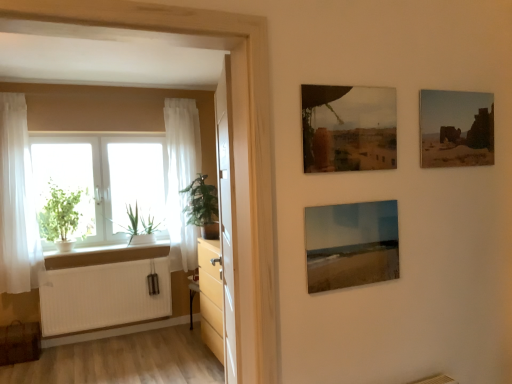
What is the approximate height of white sheer curtain at left, acting as the 2th curtain starting from the right?

It is 5.82 feet.

At what (x,y) coordinates should I click in order to perform the action: click on green leafy plant at left. Please return your answer as a coordinate pair (x, y). The image size is (512, 384). Looking at the image, I should click on (138, 226).

The image size is (512, 384). What do you see at coordinates (104, 180) in the screenshot?
I see `white glass window at left` at bounding box center [104, 180].

The image size is (512, 384). I want to click on white sheer curtain at left, the 1th curtain viewed from the right, so click(181, 178).

Describe the element at coordinates (102, 295) in the screenshot. I see `white ribbed radiator at lower left` at that location.

Locate an element on the screen. The width and height of the screenshot is (512, 384). white sheer curtain at left, acting as the 2th curtain starting from the right is located at coordinates 17,201.

Can you tell me how much white sheer curtain at left, positioned as the second curtain in left-to-right order, and white sheer curtain at left, which ranks as the 2th curtain in back-to-front order, differ in facing direction?

0.00269 degrees separate the facing orientations of white sheer curtain at left, positioned as the second curtain in left-to-right order, and white sheer curtain at left, which ranks as the 2th curtain in back-to-front order.

Is white sheer curtain at left, positioned as the second curtain in left-to-right order, touching white sheer curtain at left, the first curtain positioned from the front?

No, white sheer curtain at left, positioned as the second curtain in left-to-right order, is not next to white sheer curtain at left, the first curtain positioned from the front.

Is white sheer curtain at left, the second curtain when ordered from front to back, at the right side of white sheer curtain at left, marked as the first curtain in a left-to-right arrangement?

Yes, white sheer curtain at left, the second curtain when ordered from front to back, is to the right of white sheer curtain at left, marked as the first curtain in a left-to-right arrangement.

Between white sheer curtain at left, the second curtain when ordered from front to back, and white sheer curtain at left, marked as the first curtain in a left-to-right arrangement, which one is positioned behind?

white sheer curtain at left, the second curtain when ordered from front to back.

Is white glass window at left at the left side of green leafy plant at left?

Indeed, white glass window at left is positioned on the left side of green leafy plant at left.

Find the location of a particular element. plant behind the white glass window at left is located at coordinates (138, 226).

From a real-world perspective, which object rests below the other?

green leafy plant at left.

How many degrees apart are the facing directions of white glass window at left and green leafy plant at left?

white glass window at left and green leafy plant at left are facing 0.0072 degrees away from each other.

Relative to white sheer curtain at left, the second curtain when ordered from front to back, is white wood window sill at lower left in front or behind?

white wood window sill at lower left is positioned closer to the viewer than white sheer curtain at left, the second curtain when ordered from front to back.

Between white wood window sill at lower left and white sheer curtain at left, placed as the first curtain when sorted from back to front, which one appears on the right side from the viewer's perspective?

white sheer curtain at left, placed as the first curtain when sorted from back to front, is more to the right.

From a real-world perspective, between white wood window sill at lower left and white sheer curtain at left, the 1th curtain viewed from the right, who is vertically lower?

From a 3D spatial view, white wood window sill at lower left is below.

Is white ribbed radiator at lower left at the left side of green leafy plant at left, marked as the first houseplant in a right-to-left arrangement?

Yes, white ribbed radiator at lower left is to the left of green leafy plant at left, marked as the first houseplant in a right-to-left arrangement.

Is white ribbed radiator at lower left next to green leafy plant at left, marked as the first houseplant in a right-to-left arrangement?

white ribbed radiator at lower left and green leafy plant at left, marked as the first houseplant in a right-to-left arrangement, are not in contact.

Is white ribbed radiator at lower left in front of or behind green leafy plant at left, marked as the first houseplant in a right-to-left arrangement, in the image?

white ribbed radiator at lower left is behind green leafy plant at left, marked as the first houseplant in a right-to-left arrangement.

Considering the points (57, 293) and (210, 226), which point is in front, point (57, 293) or point (210, 226)?

Point (210, 226)

Is white wood window sill at lower left in front of or behind white glass window at left in the image?

Clearly, white wood window sill at lower left is in front of white glass window at left.

Is white wood window sill at lower left positioned far away from white glass window at left?

No, white wood window sill at lower left is not far away from white glass window at left.

Is white wood window sill at lower left positioned beyond the bounds of white glass window at left?

Yes, white wood window sill at lower left is not within white glass window at left.

Which is correct: white sheer curtain at left, positioned as the second curtain in left-to-right order, is inside green matte plant at left, arranged as the 2th houseplant when viewed from the right, or outside of it?

white sheer curtain at left, positioned as the second curtain in left-to-right order, is not inside green matte plant at left, arranged as the 2th houseplant when viewed from the right, it's outside.

From a real-world perspective, is white sheer curtain at left, placed as the first curtain when sorted from back to front, physically below green matte plant at left, arranged as the first houseplant when viewed from the left?

No, from a real-world perspective, white sheer curtain at left, placed as the first curtain when sorted from back to front, is not under green matte plant at left, arranged as the first houseplant when viewed from the left.

From the picture: Can you confirm if white sheer curtain at left, positioned as the second curtain in left-to-right order, is taller than green matte plant at left, arranged as the first houseplant when viewed from the left?

Correct, white sheer curtain at left, positioned as the second curtain in left-to-right order, is much taller as green matte plant at left, arranged as the first houseplant when viewed from the left.

From the image's perspective, which one is positioned lower, white sheer curtain at left, the second curtain when ordered from front to back, or green matte plant at left, arranged as the first houseplant when viewed from the left?

From the image's view, green matte plant at left, arranged as the first houseplant when viewed from the left, is below.

Is white sheer curtain at left, the 1th curtain viewed from the right, directly adjacent to green leafy plant at left, placed as the second houseplant when sorted from left to right?

No, white sheer curtain at left, the 1th curtain viewed from the right, is not next to green leafy plant at left, placed as the second houseplant when sorted from left to right.

At what (x,y) coordinates should I click in order to perform the action: click on the 1st curtain above the green leafy plant at left, placed as the second houseplant when sorted from left to right (from a real-world perspective). Please return your answer as a coordinate pair (x, y). The width and height of the screenshot is (512, 384). Looking at the image, I should click on (181, 178).

Does white sheer curtain at left, the second curtain when ordered from front to back, have a greater height compared to green leafy plant at left, placed as the second houseplant when sorted from left to right?

Correct, white sheer curtain at left, the second curtain when ordered from front to back, is much taller as green leafy plant at left, placed as the second houseplant when sorted from left to right.

Which object is thinner, white sheer curtain at left, the second curtain when ordered from front to back, or green leafy plant at left, placed as the second houseplant when sorted from left to right?

white sheer curtain at left, the second curtain when ordered from front to back, is thinner.

I want to click on curtain on the left of white sheer curtain at left, the second curtain when ordered from front to back, so click(x=17, y=201).

The image size is (512, 384). Find the location of `window that is above the green leafy plant at left (from a real-world perspective)`. window that is above the green leafy plant at left (from a real-world perspective) is located at coordinates (104, 180).

Considering their positions, is white wood window sill at lower left positioned closer to white sheer curtain at left, the second curtain when ordered from front to back, than white ribbed radiator at lower left?

The object closer to white sheer curtain at left, the second curtain when ordered from front to back, is white wood window sill at lower left.

Which object lies nearer to the anchor point white sheer curtain at left, marked as the first curtain in a left-to-right arrangement, white ribbed radiator at lower left or green leafy plant at left?

Based on the image, white ribbed radiator at lower left appears to be nearer to white sheer curtain at left, marked as the first curtain in a left-to-right arrangement.

Considering their positions, is white sheer curtain at left, which ranks as the 2th curtain in back-to-front order, positioned further to white sheer curtain at left, placed as the first curtain when sorted from back to front, than white glass window at left?

white sheer curtain at left, which ranks as the 2th curtain in back-to-front order, is positioned further to the anchor white sheer curtain at left, placed as the first curtain when sorted from back to front.

Consider the image. When comparing their distances from white ribbed radiator at lower left, does green matte plant at left, arranged as the 2th houseplant when viewed from the right, or white wood window sill at lower left seem closer?

Among the two, white wood window sill at lower left is located nearer to white ribbed radiator at lower left.

Looking at the image, which one is located closer to white glass window at left, white sheer curtain at left, which ranks as the 2th curtain in back-to-front order, or white ribbed radiator at lower left?

white sheer curtain at left, which ranks as the 2th curtain in back-to-front order, lies closer to white glass window at left than the other object.

From the image, which object appears to be nearer to green leafy plant at left, placed as the second houseplant when sorted from left to right, white sheer curtain at left, the 1th curtain viewed from the right, or green matte plant at left, arranged as the 2th houseplant when viewed from the right?

white sheer curtain at left, the 1th curtain viewed from the right, is positioned closer to the anchor green leafy plant at left, placed as the second houseplant when sorted from left to right.

Which object lies further to the anchor point green leafy plant at left, white sheer curtain at left, the second curtain when ordered from front to back, or white ribbed radiator at lower left?

white ribbed radiator at lower left lies further to green leafy plant at left than the other object.

Looking at the image, which one is located further to green matte plant at left, arranged as the 2th houseplant when viewed from the right, green leafy plant at left, placed as the second houseplant when sorted from left to right, or white wood window sill at lower left?

green leafy plant at left, placed as the second houseplant when sorted from left to right.

At what (x,y) coordinates should I click in order to perform the action: click on plant between green leafy plant at left, placed as the second houseplant when sorted from left to right, and white sheer curtain at left, the 1th curtain viewed from the right, along the z-axis. Please return your answer as a coordinate pair (x, y). Looking at the image, I should click on (138, 226).

What are the coordinates of `window between white sheer curtain at left, acting as the 2th curtain starting from the right, and green leafy plant at left` in the screenshot? It's located at (104, 180).

The height and width of the screenshot is (384, 512). I want to click on window that lies between white sheer curtain at left, the 1th curtain viewed from the right, and white ribbed radiator at lower left from top to bottom, so pos(104,180).

The width and height of the screenshot is (512, 384). In order to click on plant between white glass window at left and white ribbed radiator at lower left in the vertical direction in this screenshot , I will do `click(138, 226)`.